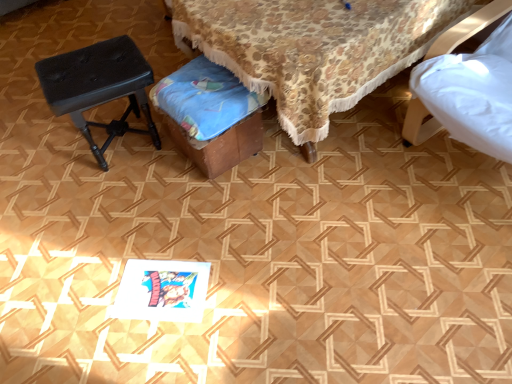
Locate an element on the screen. The width and height of the screenshot is (512, 384). free point below black leather stool at left (from a real-world perspective) is located at coordinates (124, 145).